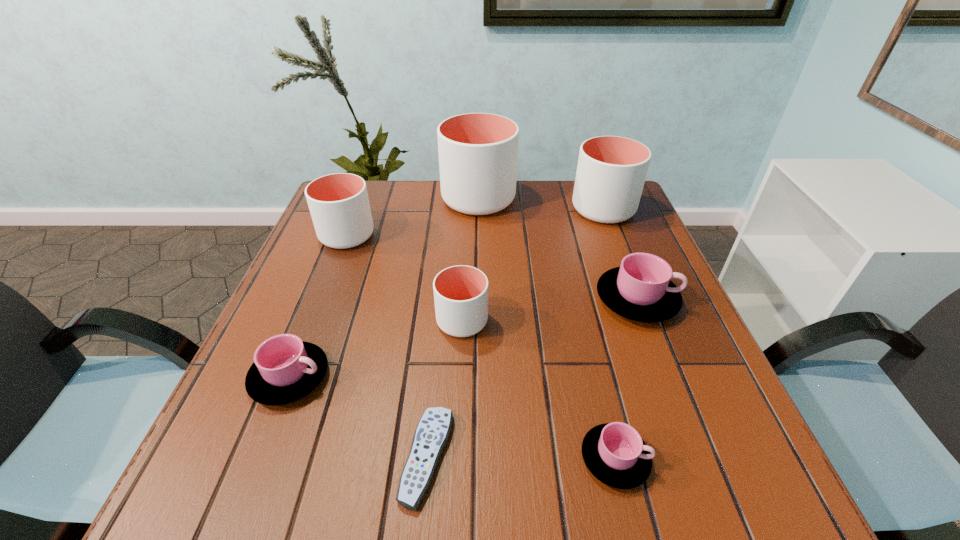
Where is `the biggest white cup`? The height and width of the screenshot is (540, 960). the biggest white cup is located at coordinates point(478,152).

This screenshot has width=960, height=540. I want to click on the tallest object, so click(478, 152).

Where is `the second tallest cup`? the second tallest cup is located at coordinates (611, 171).

Where is `the second biggest white cup`? This screenshot has height=540, width=960. the second biggest white cup is located at coordinates (611, 171).

Where is `the third biggest white cup`? Image resolution: width=960 pixels, height=540 pixels. the third biggest white cup is located at coordinates (339, 205).

Locate an element on the screen. The width and height of the screenshot is (960, 540). the fifth shortest cup is located at coordinates (339, 205).

The height and width of the screenshot is (540, 960). I want to click on the fourth shortest cup, so click(460, 292).

What are the coordinates of `the smallest white cup` in the screenshot? It's located at (460, 292).

Identify the location of the fifth tallest cup. This screenshot has width=960, height=540. (640, 289).

This screenshot has width=960, height=540. Find the location of `the farthest pink cup`. the farthest pink cup is located at coordinates (640, 289).